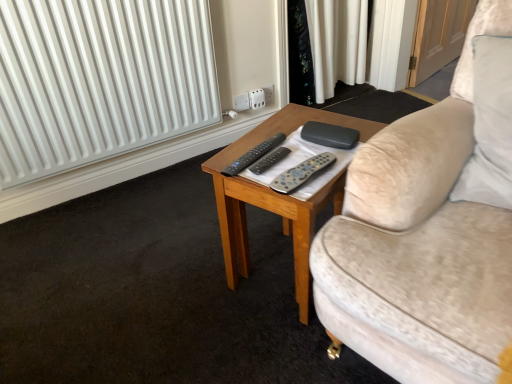
Image resolution: width=512 pixels, height=384 pixels. Identify the location of vacant area that is in front of wooden coffee table at center. [273, 350].